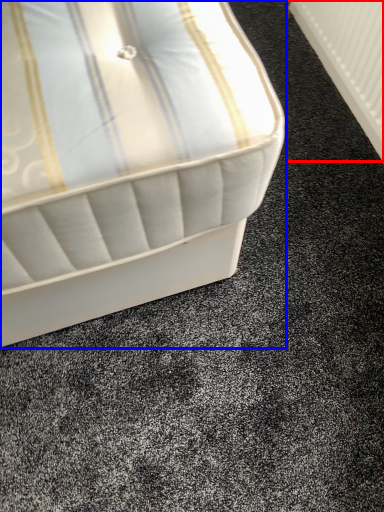
Question: Which object is further to the camera taking this photo, radiator (highlighted by a red box) or bed (highlighted by a blue box)?

Choices:
 (A) radiator
 (B) bed

Answer: (A)